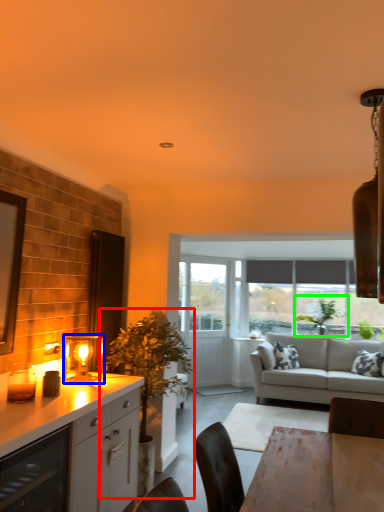
Question: Which is farther away from houseplant (highlighted by a red box)? light fixture (highlighted by a blue box) or plant (highlighted by a green box)?

Choices:
 (A) light fixture
 (B) plant

Answer: (B)